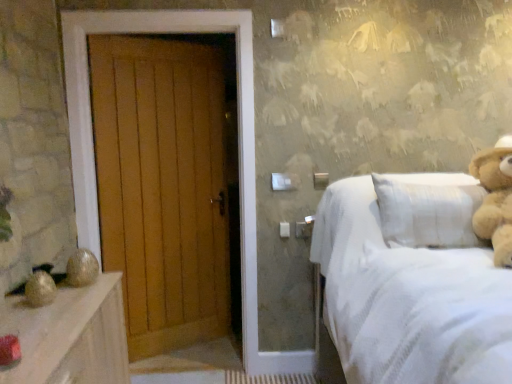
Identify the location of empty space that is ontop of wooden door at left. This screenshot has height=384, width=512. (x=155, y=6).